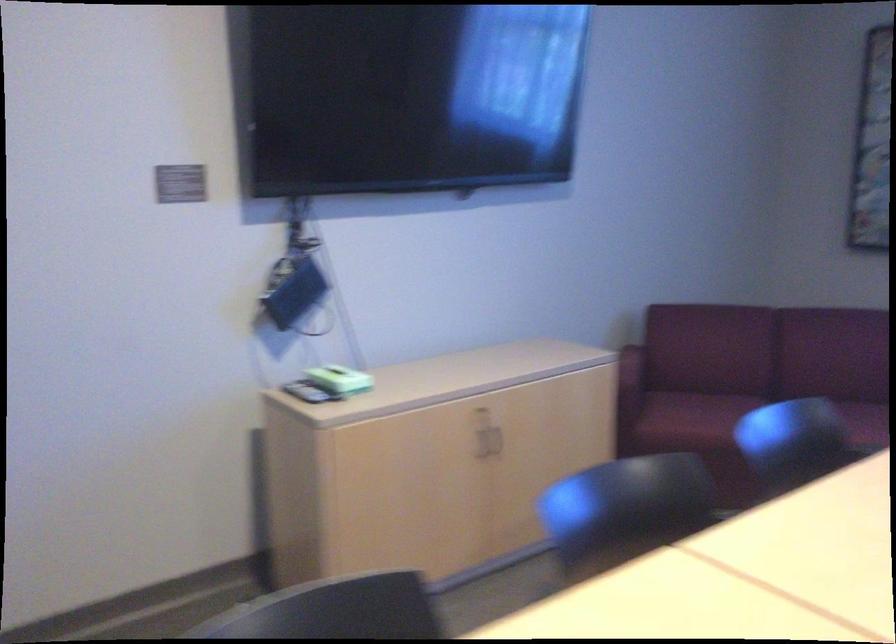
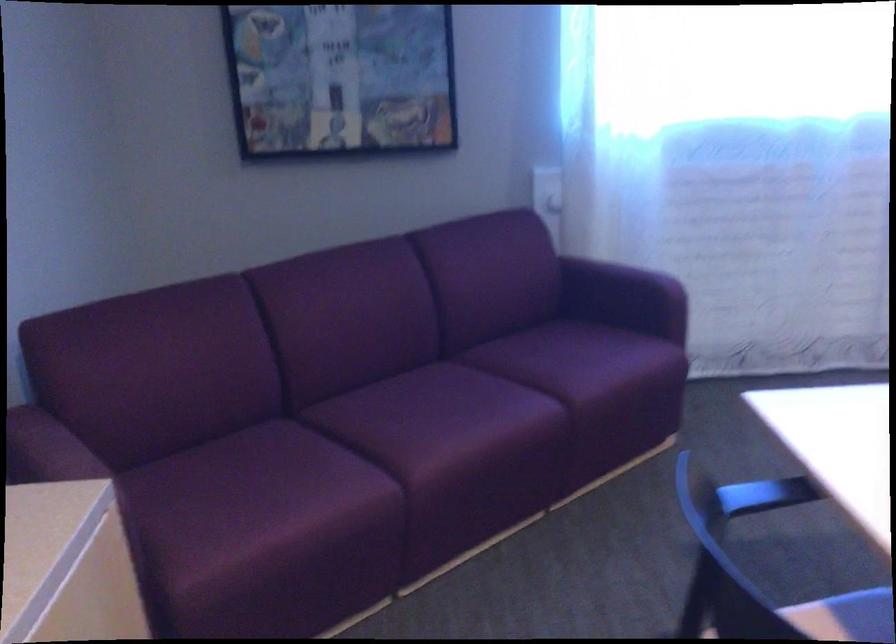
The point at (623,351) is marked in the first image. Where is the corresponding point in the second image?

(33, 446)